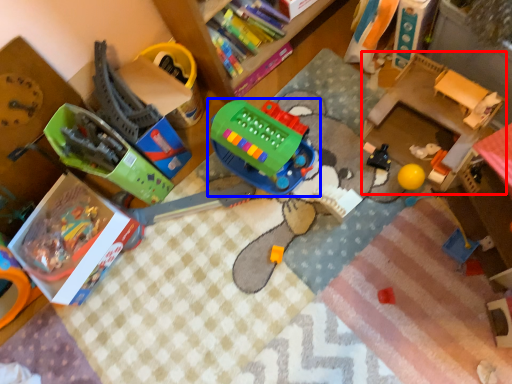
Question: Which object appears farthest to the camera in this image, changing table (highlighted by a red box) or toy (highlighted by a blue box)?

Choices:
 (A) changing table
 (B) toy

Answer: (B)